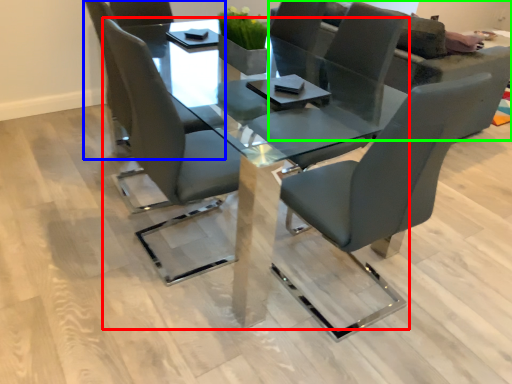
Question: Which object is positioned farthest from table (highlighted by a red box)? Select from chair (highlighted by a blue box) and couch (highlighted by a green box).

Choices:
 (A) chair
 (B) couch

Answer: (B)